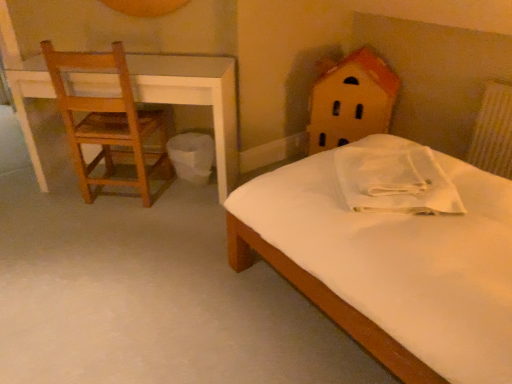
Question: Is white plastic trash bin at lower center taller than wooden chair at left?

Choices:
 (A) yes
 (B) no

Answer: (B)

Question: Can you confirm if white plastic trash bin at lower center is positioned to the right of wooden chair at left?

Choices:
 (A) yes
 (B) no

Answer: (A)

Question: Does white plastic trash bin at lower center have a lesser width compared to wooden chair at left?

Choices:
 (A) no
 (B) yes

Answer: (B)

Question: From a real-world perspective, is white plastic trash bin at lower center on top of wooden chair at left?

Choices:
 (A) yes
 (B) no

Answer: (B)

Question: Does white plastic trash bin at lower center have a lesser height compared to wooden chair at left?

Choices:
 (A) yes
 (B) no

Answer: (A)

Question: Is white plastic trash bin at lower center outside of wooden chair at left?

Choices:
 (A) no
 (B) yes

Answer: (B)

Question: Would you say white textured radiator at right contains white matte bed at center?

Choices:
 (A) yes
 (B) no

Answer: (B)

Question: Is white textured radiator at right thinner than white matte bed at center?

Choices:
 (A) no
 (B) yes

Answer: (B)

Question: Is the position of white textured radiator at right less distant than that of white matte bed at center?

Choices:
 (A) no
 (B) yes

Answer: (A)

Question: Would you say white textured radiator at right is a long distance from white matte bed at center?

Choices:
 (A) yes
 (B) no

Answer: (A)

Question: Is white textured radiator at right shorter than white matte bed at center?

Choices:
 (A) yes
 (B) no

Answer: (B)

Question: Does white textured radiator at right have a greater width compared to white matte bed at center?

Choices:
 (A) no
 (B) yes

Answer: (A)

Question: Does wooden house at upper right appear on the left side of white textured radiator at right?

Choices:
 (A) yes
 (B) no

Answer: (A)